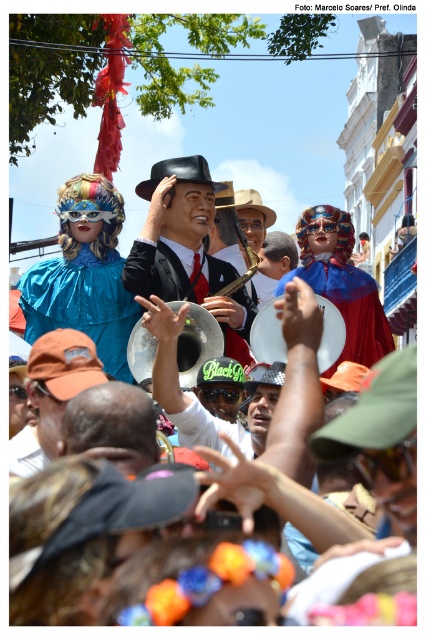
Question: Does shiny blue fabric at left have a smaller size compared to shiny red cape at center?

Choices:
 (A) yes
 (B) no

Answer: (A)

Question: Which of the following is the farthest from the observer?

Choices:
 (A) (x=353, y=348)
 (B) (x=252, y=602)
 (C) (x=158, y=170)
 (D) (x=324, y=320)

Answer: (C)

Question: Which object is positioned closest to the shiny black hat at center?

Choices:
 (A) shiny blue fabric at left
 (B) shiny silver trumpet at center
 (C) shiny red cape at center
 (D) metallic silver drum at center

Answer: (D)

Question: Does shiny black suit at center have a smaller size compared to shiny silver trumpet at center?

Choices:
 (A) no
 (B) yes

Answer: (A)

Question: Does brown fabric cap at center come behind shiny red cape at center?

Choices:
 (A) yes
 (B) no

Answer: (B)

Question: Based on their relative distances, which object is farther from the metallic silver drum at center?

Choices:
 (A) shiny red cape at center
 (B) shiny silver trumpet at center
 (C) shiny black suit at center
 (D) shiny black hat at center

Answer: (D)